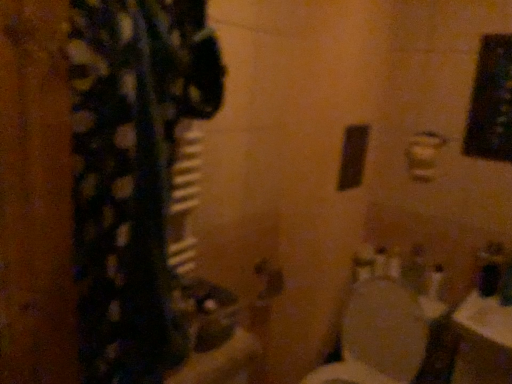
Question: From the image's perspective, relative to white glossy toilet at lower right, is metallic silver door handle at center above or below?

Choices:
 (A) above
 (B) below

Answer: (A)

Question: Based on their sizes in the image, would you say metallic silver door handle at center is bigger or smaller than white glossy toilet at lower right?

Choices:
 (A) small
 (B) big

Answer: (A)

Question: Considering their positions, is metallic silver door handle at center located in front of or behind white glossy toilet at lower right?

Choices:
 (A) front
 (B) behind

Answer: (B)

Question: Visually, is white glossy toilet at lower right positioned to the left or to the right of metallic silver door handle at center?

Choices:
 (A) left
 (B) right

Answer: (B)

Question: Considering their positions, is white glossy toilet at lower right located in front of or behind metallic silver door handle at center?

Choices:
 (A) front
 (B) behind

Answer: (A)

Question: From the image's perspective, is white glossy toilet at lower right positioned above or below metallic silver door handle at center?

Choices:
 (A) below
 (B) above

Answer: (A)

Question: Is white glossy toilet at lower right bigger or smaller than metallic silver door handle at center?

Choices:
 (A) big
 (B) small

Answer: (A)